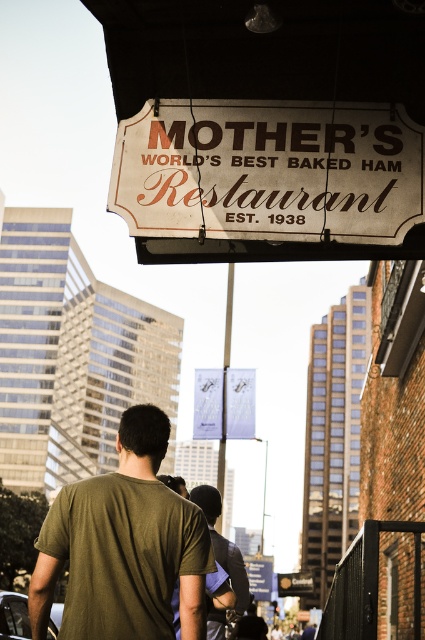
Question: Does dark green t-shirt at center come in front of metallic gold sign at center?

Choices:
 (A) yes
 (B) no

Answer: (A)

Question: Which point is closer to the camera taking this photo?

Choices:
 (A) (282, 588)
 (B) (248, 145)
 (C) (265, 600)

Answer: (B)

Question: Is dark green t-shirt at center further to the viewer compared to metallic gold sign at center?

Choices:
 (A) no
 (B) yes

Answer: (A)

Question: Which object is positioned closest to the green cotton t-shirt at center?

Choices:
 (A) white painted wood sign at upper center
 (B) wooden signboard at upper center

Answer: (A)

Question: Which of the following is the farthest from the observer?

Choices:
 (A) wooden signboard at upper center
 (B) white paper sign at center

Answer: (B)

Question: Is green cotton t-shirt at center positioned before metallic gold sign at center?

Choices:
 (A) yes
 (B) no

Answer: (A)